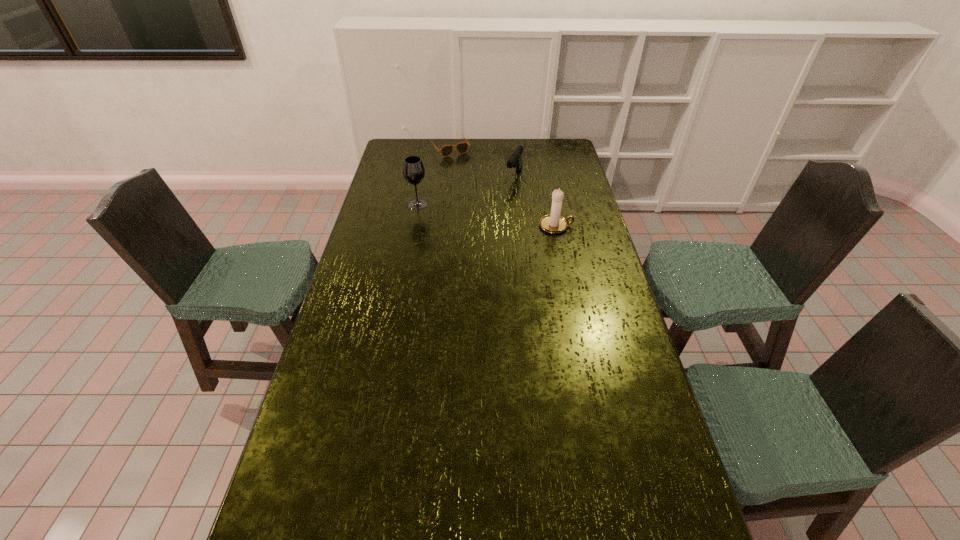
This screenshot has width=960, height=540. In order to click on free location at the far left corner in this screenshot , I will do `click(389, 150)`.

In the image, there is a desktop. In order to click on free space at the far right corner in this screenshot , I will do `click(574, 154)`.

You are a GUI agent. You are given a task and a screenshot of the screen. Output one action in this format:
    pyautogui.click(x=<x>, y=<y>)
    Task: Click on the vacant space that's between the wineglass and the rightmost object
    The width and height of the screenshot is (960, 540).
    Given the screenshot: What is the action you would take?
    pyautogui.click(x=487, y=215)

At what (x,y) coordinates should I click in order to perform the action: click on vacant space in between the pistol and the shortest object. Please return your answer as a coordinate pair (x, y). The width and height of the screenshot is (960, 540). Looking at the image, I should click on (482, 161).

Image resolution: width=960 pixels, height=540 pixels. I want to click on free point between the sunglasses and the third object from left to right, so click(x=482, y=161).

Locate an element on the screen. The height and width of the screenshot is (540, 960). free space that is in between the shortest object and the nearest object is located at coordinates (503, 187).

Locate an element on the screen. free space between the nearest object and the pistol is located at coordinates (536, 200).

This screenshot has height=540, width=960. In order to click on vacant space in between the tallest object and the third nearest object in this screenshot , I will do `click(466, 190)`.

Where is `vacant point located between the pistol and the rightmost object`? The width and height of the screenshot is (960, 540). vacant point located between the pistol and the rightmost object is located at coordinates (536, 200).

Locate an element on the screen. This screenshot has width=960, height=540. empty location between the candle holder and the shortest object is located at coordinates (503, 187).